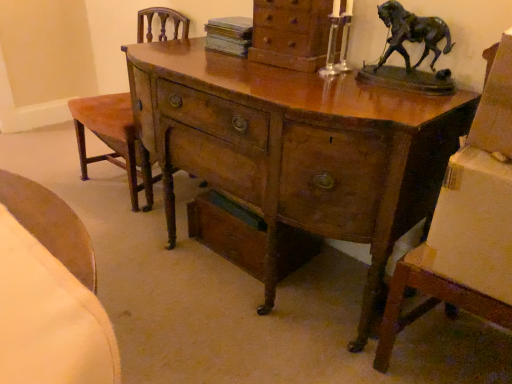
Question: From the image's perspective, is wooden drawer at lower center located above or below wooden desk at center?

Choices:
 (A) above
 (B) below

Answer: (B)

Question: From a real-world perspective, is wooden drawer at lower center positioned above or below wooden desk at center?

Choices:
 (A) below
 (B) above

Answer: (A)

Question: Considering the real-world distances, which object is closest to the wooden desk at center?

Choices:
 (A) wooden drawer at lower center
 (B) velvet orange armchair at left
 (C) wooden chest of drawers at upper center

Answer: (C)

Question: Considering the real-world distances, which object is closest to the wooden drawer at lower center?

Choices:
 (A) velvet orange armchair at left
 (B) wooden chest of drawers at upper center
 (C) wooden desk at center

Answer: (C)